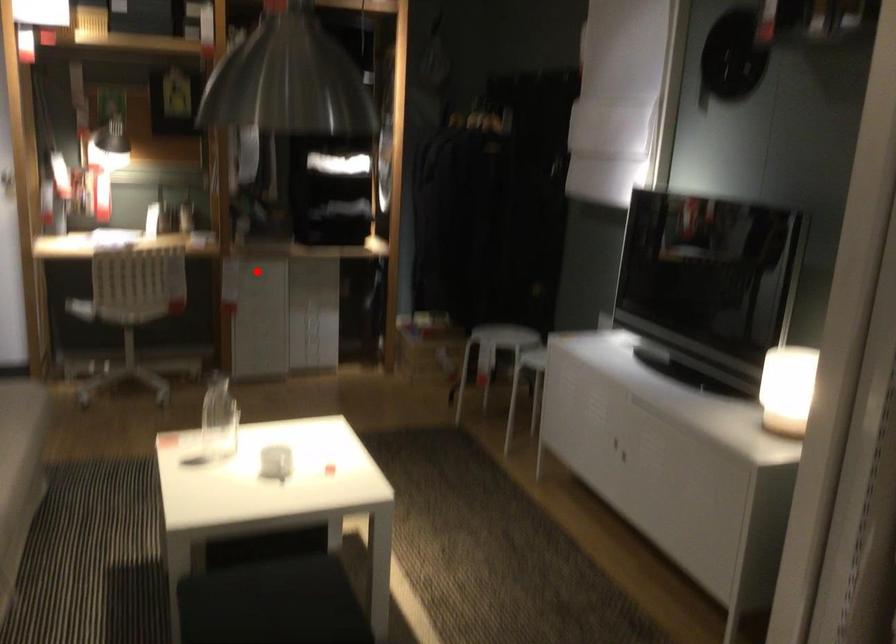
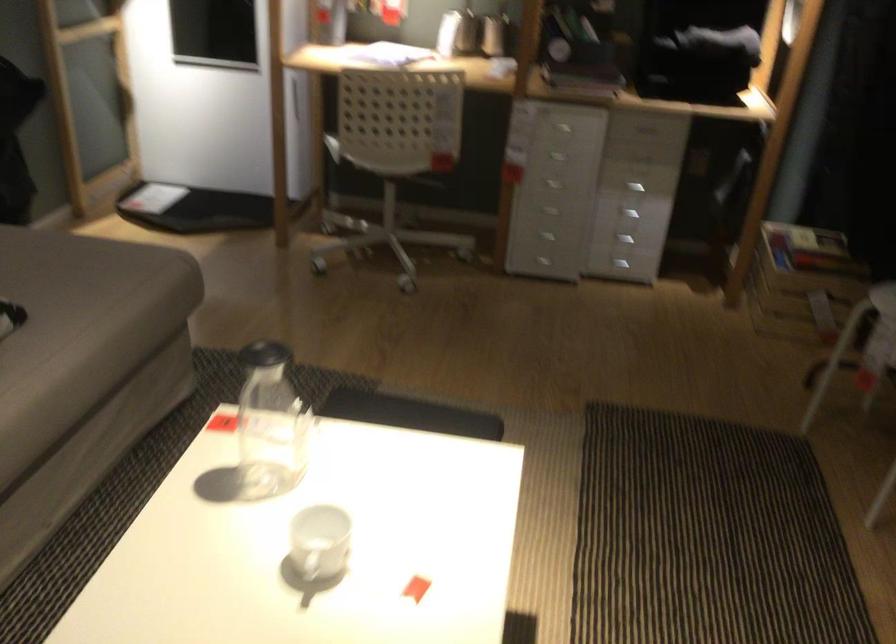
In the second image, find the point that corresponds to the highlighted location in the first image.

(563, 128)